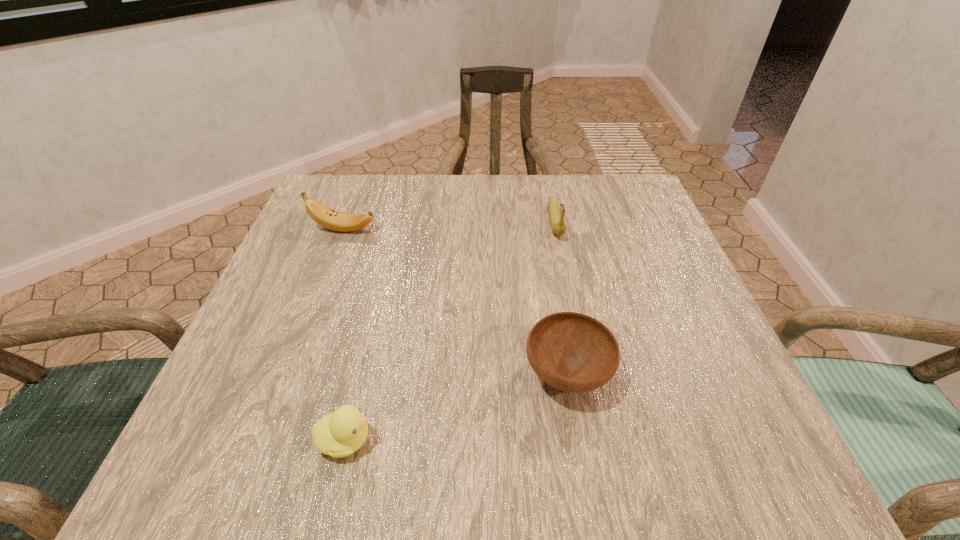
Locate an element on the screen. Image resolution: width=960 pixels, height=540 pixels. the right banana is located at coordinates (558, 227).

I want to click on the left banana, so click(x=328, y=217).

You are a GUI agent. You are given a task and a screenshot of the screen. Output one action in this format:
    pyautogui.click(x=<x>, y=<y>)
    Task: Click on the third farthest object
    
    Given the screenshot: What is the action you would take?
    pyautogui.click(x=573, y=352)

The width and height of the screenshot is (960, 540). Identify the location of the nearest object. (341, 433).

Where is `blank area located 0.060m at the stem of the right banana`? This screenshot has width=960, height=540. blank area located 0.060m at the stem of the right banana is located at coordinates (564, 261).

What are the coordinates of `vacant area located 0.400m on the right of the left banana` in the screenshot? It's located at 553,229.

Locate an element on the screen. This screenshot has height=540, width=960. free location located 0.260m on the back of the bowl is located at coordinates (545, 246).

The height and width of the screenshot is (540, 960). Find the location of `free location located 0.160m at the beak of the nearest object`. free location located 0.160m at the beak of the nearest object is located at coordinates (485, 440).

Where is `object present at the near edge`? The height and width of the screenshot is (540, 960). object present at the near edge is located at coordinates (341, 433).

I want to click on object that is positioned at the left edge, so click(x=328, y=217).